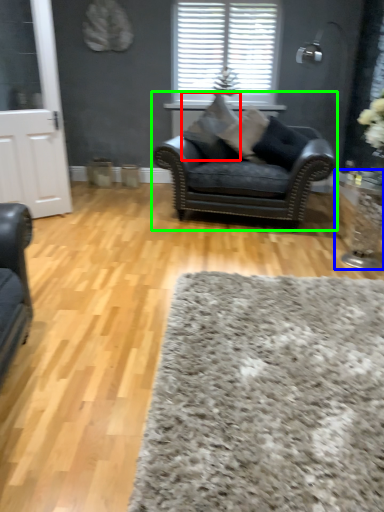
Question: Based on their relative distances, which object is farther from pillow (highlighted by a red box)? Choose from side table (highlighted by a blue box) and chair (highlighted by a green box).

Choices:
 (A) side table
 (B) chair

Answer: (A)